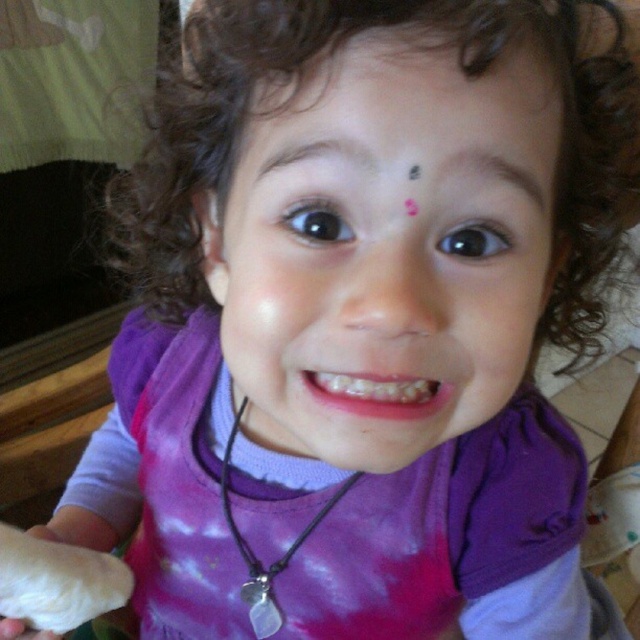
Question: Which point is farther from the camera taking this photo?

Choices:
 (A) (262, 596)
 (B) (291, 268)
 (C) (248, 134)

Answer: (A)

Question: Considering the real-world distances, which object is farthest from the silver metallic necklace at center?

Choices:
 (A) purple fabric face at center
 (B) pink matte forehead at upper center

Answer: (B)

Question: Can you confirm if purple fabric face at center is bigger than pink matte forehead at upper center?

Choices:
 (A) no
 (B) yes

Answer: (B)

Question: Is purple fabric face at center below pink matte forehead at upper center?

Choices:
 (A) no
 (B) yes

Answer: (B)

Question: Which point appears farthest from the camera in this image?

Choices:
 (A) (378, 365)
 (B) (440, 33)
 (C) (273, 620)

Answer: (C)

Question: Does purple fabric face at center appear on the left side of silver metallic necklace at center?

Choices:
 (A) no
 (B) yes

Answer: (A)